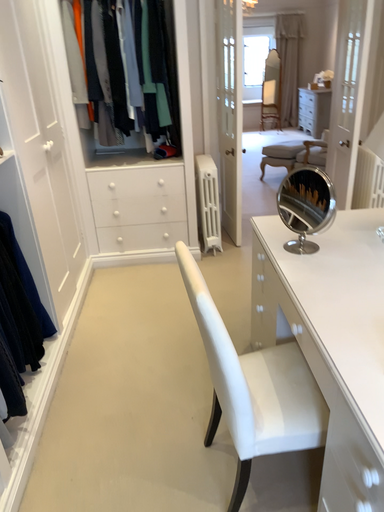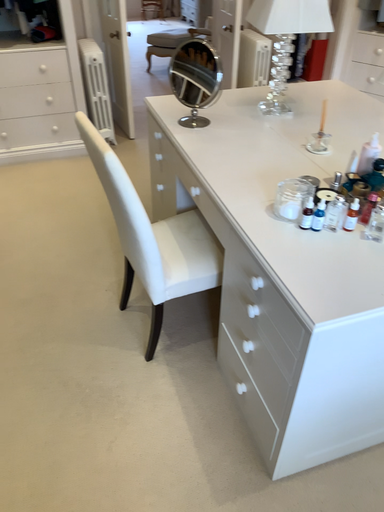
Question: How did the camera likely rotate when shooting the video?

Choices:
 (A) rotated downward
 (B) rotated upward

Answer: (A)